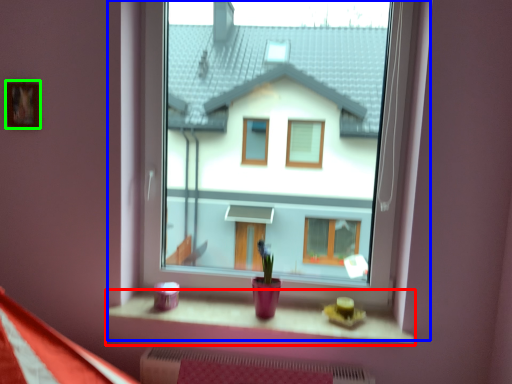
Question: Which object is positioned closest to window sill (highlighted by a red box)? Select from window (highlighted by a blue box) and picture frame (highlighted by a green box).

Choices:
 (A) window
 (B) picture frame

Answer: (B)